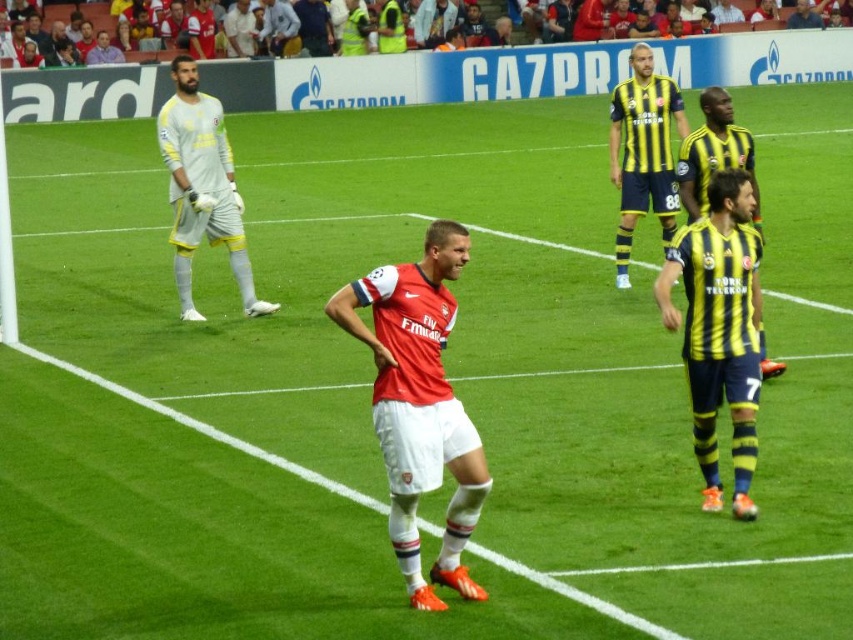
Can you confirm if matte red jersey at center is wider than dark blue jersey at upper center?

In fact, matte red jersey at center might be narrower than dark blue jersey at upper center.

Is matte red jersey at center further to the viewer compared to dark blue jersey at upper center?

No, matte red jersey at center is closer to the viewer.

Is point (398, 392) positioned behind point (788, 26)?

No, it is in front of (788, 26).

This screenshot has height=640, width=853. Identify the location of matte red jersey at center. (419, 404).

Does matte red jersey at center have a lesser height compared to yellow and black striped jersey at upper center?

In fact, matte red jersey at center may be taller than yellow and black striped jersey at upper center.

Between point (375, 362) and point (621, 88), which one is positioned in front?

Positioned in front is point (375, 362).

Which is in front, point (395, 529) or point (627, 192)?

Point (395, 529) is in front.

Find the location of `matte red jersey at center`. matte red jersey at center is located at coordinates (419, 404).

Who is more distant from viewer, (175, 257) or (727, 136)?

The point (175, 257) is behind.

Where is `white matte jersey at left`? The height and width of the screenshot is (640, 853). white matte jersey at left is located at coordinates (202, 186).

You are a GUI agent. You are given a task and a screenshot of the screen. Output one action in this format:
    pyautogui.click(x=<x>, y=<y>)
    Task: Click on the white matte jersey at left
    
    Given the screenshot: What is the action you would take?
    pyautogui.click(x=202, y=186)